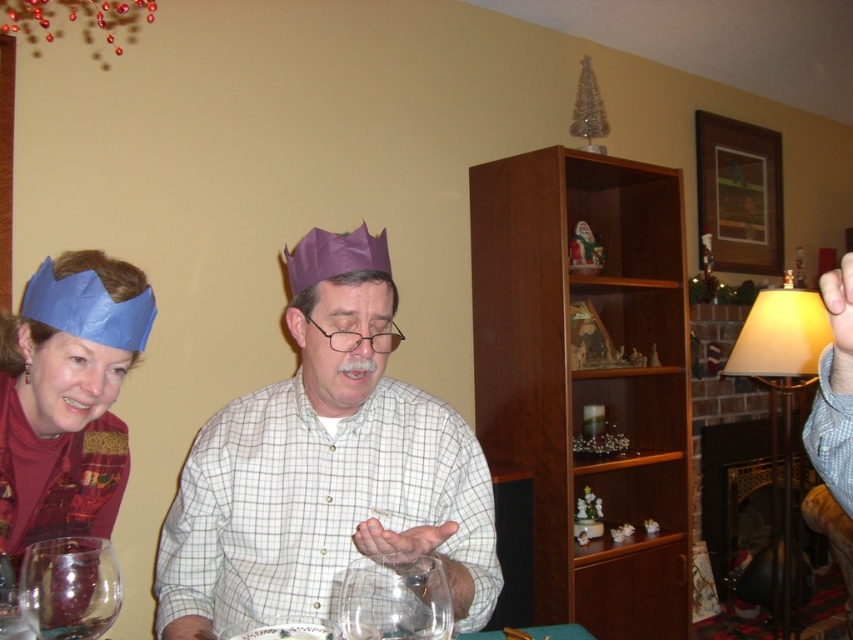
Question: Among these points, which one is farthest from the camera?

Choices:
 (A) (74, 467)
 (B) (35, 573)
 (C) (465, 593)

Answer: (A)

Question: Is purple paper crown at center positioned behind blue paper crown at left?

Choices:
 (A) yes
 (B) no

Answer: (B)

Question: Which object is positioned closest to the transparent glass at center?

Choices:
 (A) transparent glass wine glass at lower left
 (B) blue paper crown at left
 (C) purple paper crown at center

Answer: (A)

Question: Can you confirm if transparent glass wine glass at lower left is wider than transparent glass at center?

Choices:
 (A) yes
 (B) no

Answer: (A)

Question: Estimate the real-world distances between objects in this image. Which object is closer to the transparent glass wine glass at lower left?

Choices:
 (A) transparent glass at center
 (B) blue paper crown at left

Answer: (A)

Question: From the image, what is the correct spatial relationship of purple paper crown at center in relation to transparent glass at center?

Choices:
 (A) above
 (B) below

Answer: (A)